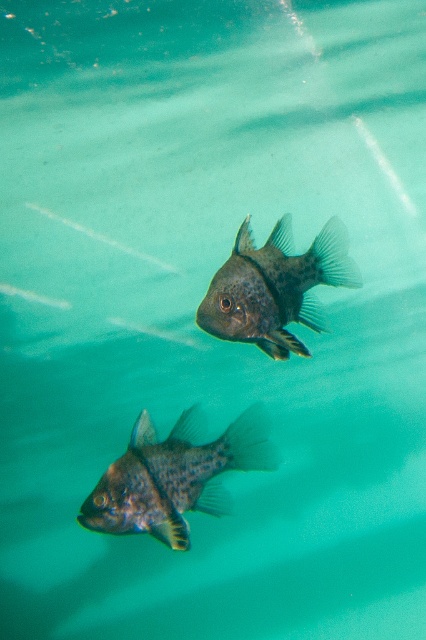
You are a scuba diver observing two speckled dark fish underwater. You see the speckled dark fish at bottom left and the speckled dark fish at center. Which fish is closer to you?

The speckled dark fish at bottom left is closer to you because it is further to the viewer than the speckled dark fish at center.

You are an underwater photographer aiming to capture both the speckled dark fish at bottom left and the speckled dark fish at center in a single frame. Based on their positions, which fish is positioned closer to the bottom of the image?

The speckled dark fish at bottom left is closer to the bottom of the image because it is located at the bottom left position, which is lower than the center position.

You are an underwater photographer aiming to capture both the speckled dark fish at bottom left and the speckled dark fish at center in a single frame. Based on their positions, which fish is closer to the left edge of your camera view?

The speckled dark fish at bottom left is positioned to the left of the speckled dark fish at center, so it is closer to the left edge of the camera view.